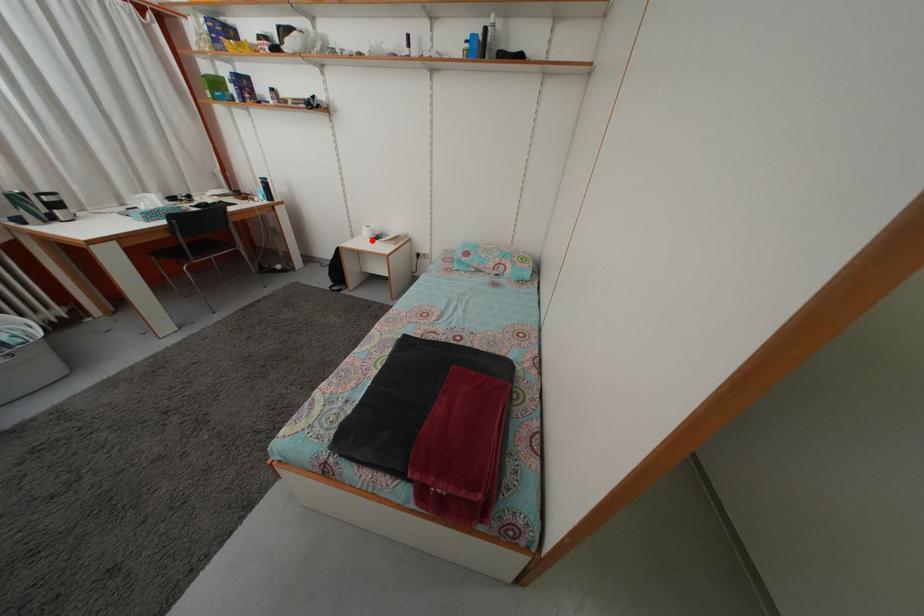
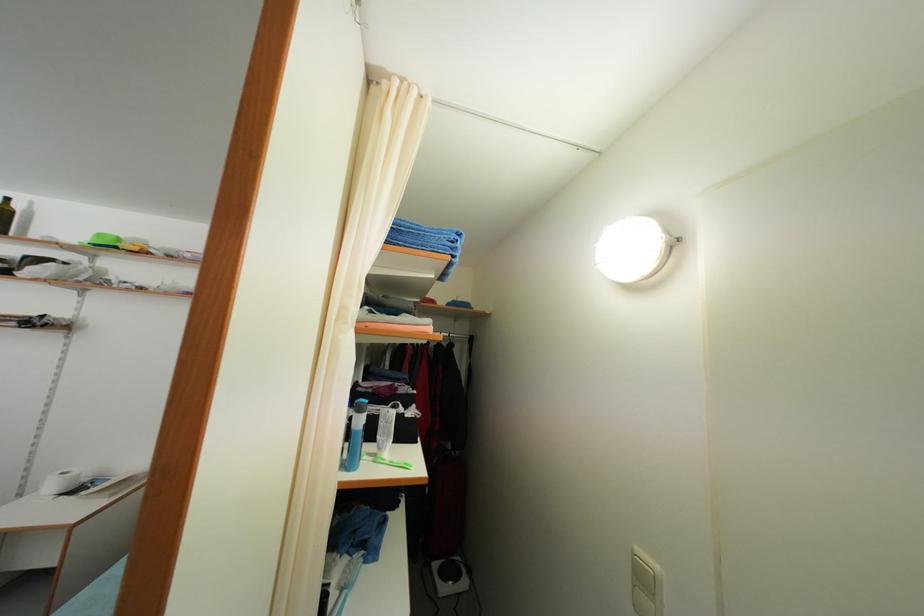
Question: A red point is marked in image1. In image2, is the corresponding 3D point closer to the camera or farther? Reply with the corresponding letter.

Choices:
 (A) The corresponding 3D point is closer.
 (B) The corresponding 3D point is farther.

Answer: (A)